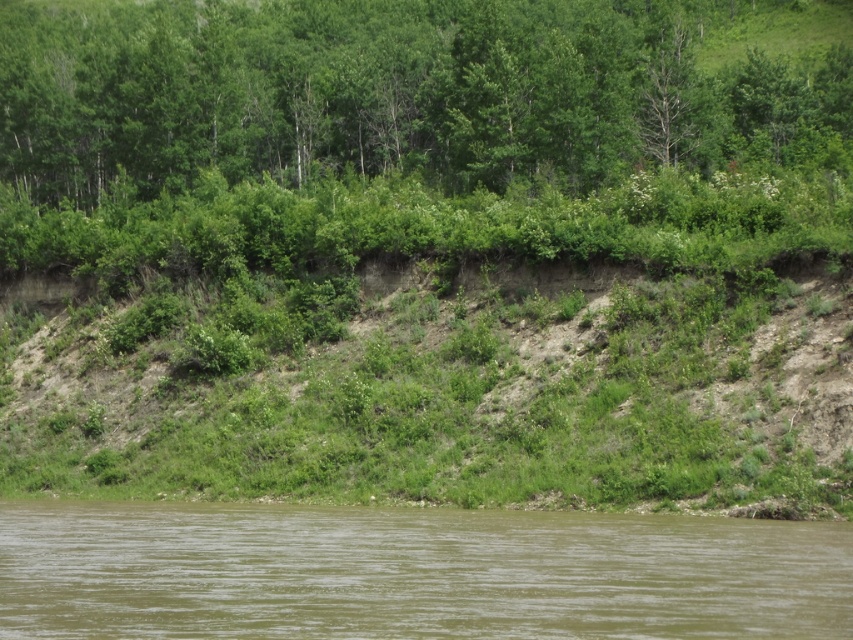
You are an environmental scientist assessing the health of this river. You notice the green leafy trees at upper center and the brown muddy water at lower center. Which of these two features has a greater width in the image?

The green leafy trees at upper center has a greater width than the brown muddy water at lower center according to the description.

You are standing at the edge of the river and want to climb up to the forest. Which direction should you head towards relative to the brown muddy water at lower center to reach the green leafy trees at upper center?

The green leafy trees at upper center are located above the brown muddy water at lower center, so you should head upwards from the brown muddy water at lower center to reach the green leafy trees at upper center.

You are a hiker standing at the edge of the brown muddy water at lower center and want to reach the green leafy trees at upper center. Which direction should you head towards to get there?

The green leafy trees at upper center are taller than the brown muddy water at lower center, so you should head upwards towards the green leafy trees at upper center.